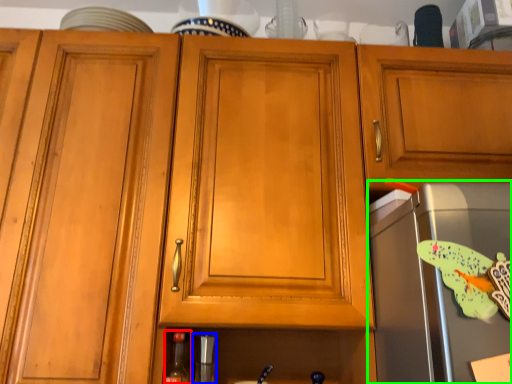
Question: Which object is the farthest from bottle (highlighted by a red box)? Choose among these: appliance (highlighted by a blue box) or appliance (highlighted by a green box).

Choices:
 (A) appliance
 (B) appliance

Answer: (B)